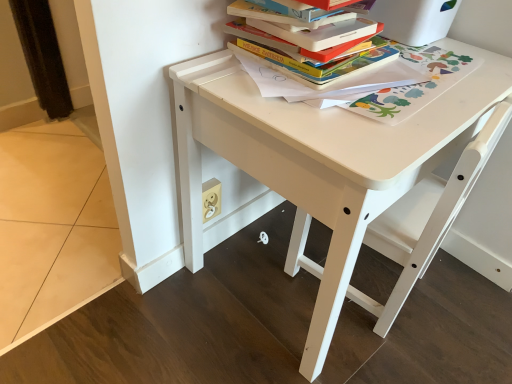
Question: Does hardcover book at upper center appear on the left side of hardcover books at upper center?

Choices:
 (A) no
 (B) yes

Answer: (B)

Question: Is hardcover book at upper center in front of hardcover books at upper center?

Choices:
 (A) no
 (B) yes

Answer: (B)

Question: Is hardcover book at upper center shorter than hardcover books at upper center?

Choices:
 (A) no
 (B) yes

Answer: (B)

Question: Is hardcover book at upper center facing away from hardcover books at upper center?

Choices:
 (A) yes
 (B) no

Answer: (B)

Question: Is hardcover book at upper center far from hardcover books at upper center?

Choices:
 (A) yes
 (B) no

Answer: (B)

Question: From a real-world perspective, is hardcover book at upper center on hardcover books at upper center?

Choices:
 (A) yes
 (B) no

Answer: (A)

Question: Can you confirm if white matte chair at center is taller than white matte table at center?

Choices:
 (A) yes
 (B) no

Answer: (B)

Question: Considering the relative sizes of white matte chair at center and white matte table at center in the image provided, is white matte chair at center shorter than white matte table at center?

Choices:
 (A) no
 (B) yes

Answer: (B)

Question: Does white matte chair at center have a lesser width compared to white matte table at center?

Choices:
 (A) yes
 (B) no

Answer: (A)

Question: From a real-world perspective, is white matte chair at center located beneath white matte table at center?

Choices:
 (A) yes
 (B) no

Answer: (A)

Question: Is white matte chair at center wider than white matte table at center?

Choices:
 (A) yes
 (B) no

Answer: (B)

Question: Are white matte chair at center and white matte table at center located far from each other?

Choices:
 (A) yes
 (B) no

Answer: (B)

Question: From a real-world perspective, is hardcover books at upper center physically above white matte chair at center?

Choices:
 (A) yes
 (B) no

Answer: (A)